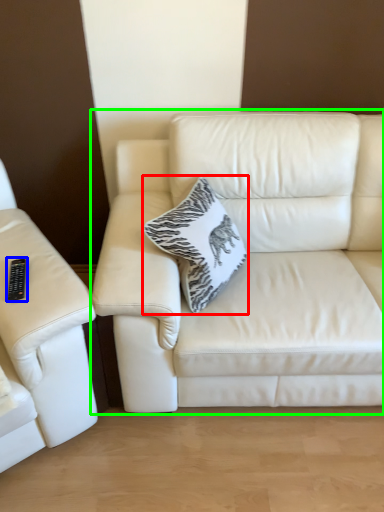
Question: Considering the real-world distances, which object is closest to throw pillow (highlighted by a red box)? remote (highlighted by a blue box) or studio couch (highlighted by a green box).

Choices:
 (A) remote
 (B) studio couch

Answer: (B)